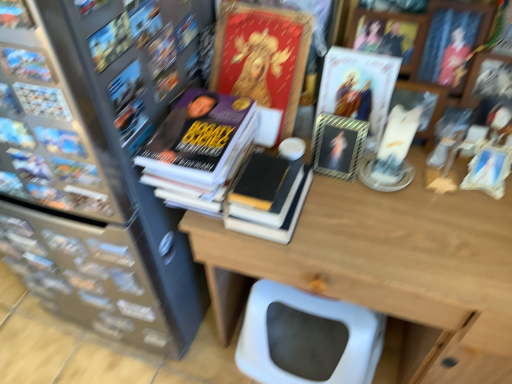
You are a GUI agent. You are given a task and a screenshot of the screen. Output one action in this format:
    pyautogui.click(x=<x>, y=<y>)
    Task: Click on the hardcover book at center, the 3th book viewed from the left
    
    Given the screenshot: What is the action you would take?
    pyautogui.click(x=267, y=197)

This screenshot has height=384, width=512. Describe the element at coordinates (267, 197) in the screenshot. I see `hardcover book at center, arranged as the third book when viewed from the front` at that location.

The width and height of the screenshot is (512, 384). What do you see at coordinates (338, 146) in the screenshot?
I see `metallic silver frame at upper center, positioned as the 2th book cover in left-to-right order` at bounding box center [338, 146].

What are the coordinates of `metallic silver frame at upper center, positioned as the 2th book cover in left-to-right order` in the screenshot? It's located at (338, 146).

Describe the element at coordinates (358, 88) in the screenshot. I see `metallic gold frame at upper center, the 1th book cover when ordered from right to left` at that location.

The image size is (512, 384). Describe the element at coordinates (42, 101) in the screenshot. I see `matte black book at left, which is counted as the second book, starting from the front` at that location.

Identify the location of matte black book at upper left, the first book positioned from the left. This screenshot has height=384, width=512. (26, 63).

Considering the positions of objects metallic silver frame at upper center, positioned as the 2th book cover in left-to-right order, and hardcover book at center, the first book when ordered from right to left, in the image provided, who is behind, metallic silver frame at upper center, positioned as the 2th book cover in left-to-right order, or hardcover book at center, the first book when ordered from right to left,?

metallic silver frame at upper center, positioned as the 2th book cover in left-to-right order, is further from the camera.

From the image's perspective, which object appears higher, metallic silver frame at upper center, the 2th book cover positioned from the right, or hardcover book at center, the first book when ordered from right to left?

metallic silver frame at upper center, the 2th book cover positioned from the right, appears higher in the image.

How different are the orientations of metallic silver frame at upper center, the 2th book cover positioned from the right, and hardcover book at center, the first book when ordered from back to front, in degrees?

The angle between the facing direction of metallic silver frame at upper center, the 2th book cover positioned from the right, and the facing direction of hardcover book at center, the first book when ordered from back to front, is 0.000401 degrees.

From a real-world perspective, which is physically below, matte black bookcase at left or matte black book at upper left, placed as the 3th book when sorted from right to left?

matte black bookcase at left, from a real-world perspective.

Is matte black bookcase at left next to matte black book at upper left, the first book positioned from the left, and touching it?

matte black bookcase at left is not next to matte black book at upper left, the first book positioned from the left, and they're not touching.

From the picture: Could you tell me if matte black bookcase at left is facing matte black book at upper left, positioned as the 1th book in front-to-back order?

Yes, matte black bookcase at left is oriented towards matte black book at upper left, positioned as the 1th book in front-to-back order.

Which is more to the right, matte black bookcase at left or matte black book at upper left, the third book viewed from the back?

Positioned to the right is matte black book at upper left, the third book viewed from the back.

Consider the image. Is matte gold book at center, marked as the third book cover in a right-to-left arrangement, in contact with metallic gold frame at upper center, the 1th book cover when ordered from right to left?

There is a gap between matte gold book at center, marked as the third book cover in a right-to-left arrangement, and metallic gold frame at upper center, the 1th book cover when ordered from right to left.

Does matte gold book at center, which is counted as the first book cover, starting from the left, appear on the right side of metallic gold frame at upper center, which is the 3th book cover from left to right?

No, matte gold book at center, which is counted as the first book cover, starting from the left, is not to the right of metallic gold frame at upper center, which is the 3th book cover from left to right.

Does matte gold book at center, which is counted as the first book cover, starting from the left, contain metallic gold frame at upper center, which is the 3th book cover from left to right?

That's incorrect, metallic gold frame at upper center, which is the 3th book cover from left to right, is not inside matte gold book at center, which is counted as the first book cover, starting from the left.

Is matte black bookcase at left bigger than wooden table at center?

Indeed, matte black bookcase at left has a larger size compared to wooden table at center.

From the image's perspective, does matte black bookcase at left appear higher than wooden table at center?

Indeed, from the image's perspective, matte black bookcase at left is shown above wooden table at center.

Is matte black bookcase at left positioned beyond the bounds of wooden table at center?

Yes.

Which is behind, point (102, 239) or point (457, 219)?

The point (102, 239) is farther.

Considering the sizes of objects metallic gold frame at upper center, which is the 3th book cover from left to right, and wooden table at center in the image provided, who is bigger, metallic gold frame at upper center, which is the 3th book cover from left to right, or wooden table at center?

wooden table at center.

Based on the photo, is the surface of metallic gold frame at upper center, the 1th book cover when ordered from right to left, in direct contact with wooden table at center?

No, metallic gold frame at upper center, the 1th book cover when ordered from right to left, is not beside wooden table at center.

Can you confirm if metallic gold frame at upper center, the 1th book cover when ordered from right to left, is shorter than wooden table at center?

Yes, metallic gold frame at upper center, the 1th book cover when ordered from right to left, is shorter than wooden table at center.

From the image's perspective, is matte black book at upper left, the third book viewed from the back, on matte gold book at center, marked as the third book cover in a right-to-left arrangement?

Incorrect, from the image's perspective, matte black book at upper left, the third book viewed from the back, is lower than matte gold book at center, marked as the third book cover in a right-to-left arrangement.

Is matte black book at upper left, positioned as the 1th book in front-to-back order, positioned with its back to matte gold book at center, which is counted as the first book cover, starting from the left?

No.

From a real-world perspective, between matte black book at upper left, the third book viewed from the back, and matte gold book at center, which is counted as the first book cover, starting from the left, who is vertically higher?

In real-world perspective, matte black book at upper left, the third book viewed from the back, is above.

Which is more to the right, matte black book at upper left, the third book viewed from the back, or matte gold book at center, marked as the third book cover in a right-to-left arrangement?

From the viewer's perspective, matte gold book at center, marked as the third book cover in a right-to-left arrangement, appears more on the right side.

Is wooden table at center touching metallic silver frame at upper center, positioned as the 2th book cover in left-to-right order?

They are not placed beside each other.

Would you say wooden table at center is inside or outside metallic silver frame at upper center, positioned as the 2th book cover in left-to-right order?

wooden table at center exists outside the volume of metallic silver frame at upper center, positioned as the 2th book cover in left-to-right order.

Could you tell me if wooden table at center is turned towards metallic silver frame at upper center, positioned as the 2th book cover in left-to-right order?

No, wooden table at center is not oriented towards metallic silver frame at upper center, positioned as the 2th book cover in left-to-right order.

Where is `book cover below the hardcover book at center, the 3th book viewed from the left (from a real-world perspective)`? Image resolution: width=512 pixels, height=384 pixels. book cover below the hardcover book at center, the 3th book viewed from the left (from a real-world perspective) is located at coordinates (338, 146).

Identify the location of bookcase that is below the matte black book at upper left, the first book positioned from the left (from the image's perspective). (93, 187).

Looking at the image, which one is located closer to metallic silver frame at upper center, positioned as the 2th book cover in left-to-right order, matte black book at upper left, the third book viewed from the back, or metallic gold frame at upper center, the 1th book cover when ordered from right to left?

The object closer to metallic silver frame at upper center, positioned as the 2th book cover in left-to-right order, is metallic gold frame at upper center, the 1th book cover when ordered from right to left.

When comparing their distances from matte black book at left, acting as the 2th book starting from the right, does matte black bookcase at left or hardcover book at center, the first book when ordered from back to front, seem closer?

hardcover book at center, the first book when ordered from back to front.

Considering their positions, is matte black book at left, acting as the 2th book starting from the right, positioned closer to wooden table at center than metallic gold frame at upper center, the 1th book cover when ordered from right to left?

metallic gold frame at upper center, the 1th book cover when ordered from right to left, is closer to wooden table at center.

Based on their spatial positions, is matte gold book at center, marked as the third book cover in a right-to-left arrangement, or matte black book at upper left, positioned as the 1th book in front-to-back order, closer to hardcover book at center, the first book when ordered from back to front?

matte gold book at center, marked as the third book cover in a right-to-left arrangement, is closer to hardcover book at center, the first book when ordered from back to front.

When comparing their distances from matte black bookcase at left, does matte black book at upper left, the first book positioned from the left, or matte black book at left, which is the 2th book from left to right, seem closer?

matte black book at left, which is the 2th book from left to right, lies closer to matte black bookcase at left than the other object.

Based on their spatial positions, is metallic gold frame at upper center, which is the 3th book cover from left to right, or matte black book at left, acting as the 2th book starting from the right, further from matte black bookcase at left?

The object further to matte black bookcase at left is metallic gold frame at upper center, which is the 3th book cover from left to right.

Based on their spatial positions, is matte black book at left, which is the 2th book from left to right, or hardcover book at center, arranged as the third book when viewed from the front, closer to matte gold book at center, marked as the third book cover in a right-to-left arrangement?

The object closer to matte gold book at center, marked as the third book cover in a right-to-left arrangement, is hardcover book at center, arranged as the third book when viewed from the front.

When comparing their distances from matte black book at left, the second book positioned from the back, does metallic gold frame at upper center, which is the 3th book cover from left to right, or wooden table at center seem further?

Among the two, wooden table at center is located further to matte black book at left, the second book positioned from the back.

At what (x,y) coordinates should I click in order to perform the action: click on book cover between matte gold book at center, marked as the third book cover in a right-to-left arrangement, and metallic silver frame at upper center, the 2th book cover positioned from the right, in the up-down direction. Please return your answer as a coordinate pair (x, y). Image resolution: width=512 pixels, height=384 pixels. Looking at the image, I should click on (358, 88).

Image resolution: width=512 pixels, height=384 pixels. I want to click on book located between matte black book at left, which is the 2th book from left to right, and metallic silver frame at upper center, positioned as the 2th book cover in left-to-right order, in the left-right direction, so click(x=267, y=197).

Where is `book located between matte black book at left, which is counted as the second book, starting from the front, and wooden table at center in the left-right direction`? book located between matte black book at left, which is counted as the second book, starting from the front, and wooden table at center in the left-right direction is located at coordinates (267, 197).

Where is `book cover located between matte black book at left, the second book positioned from the back, and metallic silver frame at upper center, positioned as the 2th book cover in left-to-right order, in the left-right direction`? This screenshot has height=384, width=512. book cover located between matte black book at left, the second book positioned from the back, and metallic silver frame at upper center, positioned as the 2th book cover in left-to-right order, in the left-right direction is located at coordinates (262, 57).